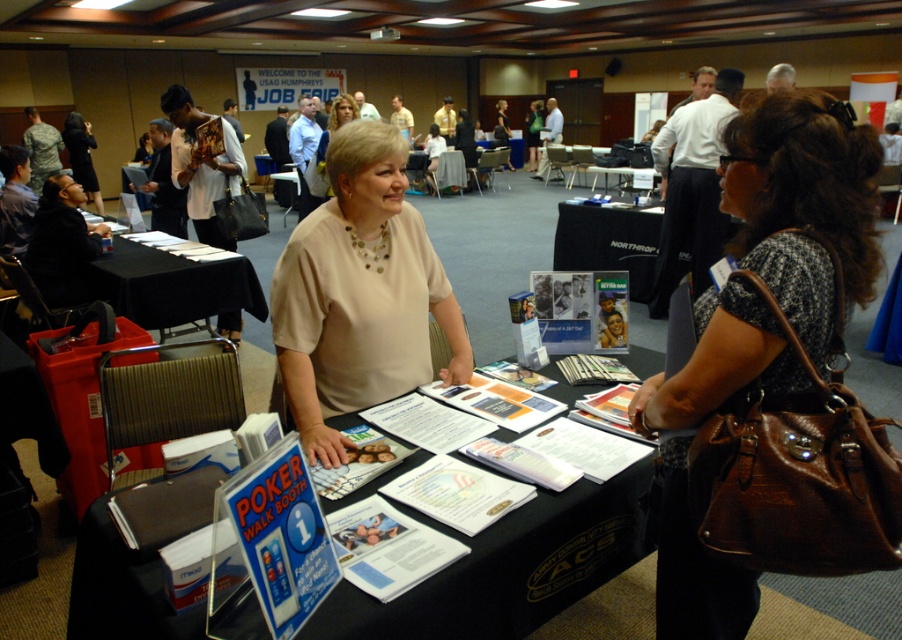
Does black paper at left come in front of black fabric table at center?

Yes, black paper at left is closer to the viewer.

Is black paper at left below black fabric table at center?

Yes, black paper at left is below black fabric table at center.

Find the location of a particular element. This screenshot has width=902, height=640. black paper at left is located at coordinates (175, 285).

Does point (578, 246) come behind point (585, 170)?

No, it is not.

Is black fabric table at center shorter than black plastic table at center?

No.

Which is behind, point (611, 228) or point (617, 172)?

Point (617, 172)

The image size is (902, 640). In order to click on black fabric table at center in this screenshot , I will do click(609, 243).

Can you confirm if matte beige blouse at center is positioned to the left of black plastic table at center?

Correct, you'll find matte beige blouse at center to the left of black plastic table at center.

Is point (336, 125) positioned behind point (629, 168)?

No, (336, 125) is closer to viewer.

Is point (336, 129) closer to viewer compared to point (627, 179)?

Yes, point (336, 129) is closer to viewer.

Locate an element on the screen. matte beige blouse at center is located at coordinates (329, 138).